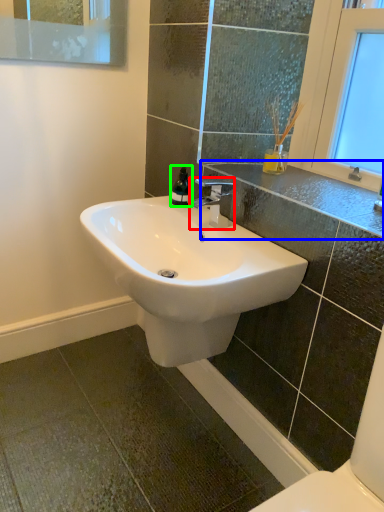
Question: Considering the real-world distances, which object is farthest from tap (highlighted by a red box)? counter top (highlighted by a blue box) or soap dispenser (highlighted by a green box)?

Choices:
 (A) counter top
 (B) soap dispenser

Answer: (A)